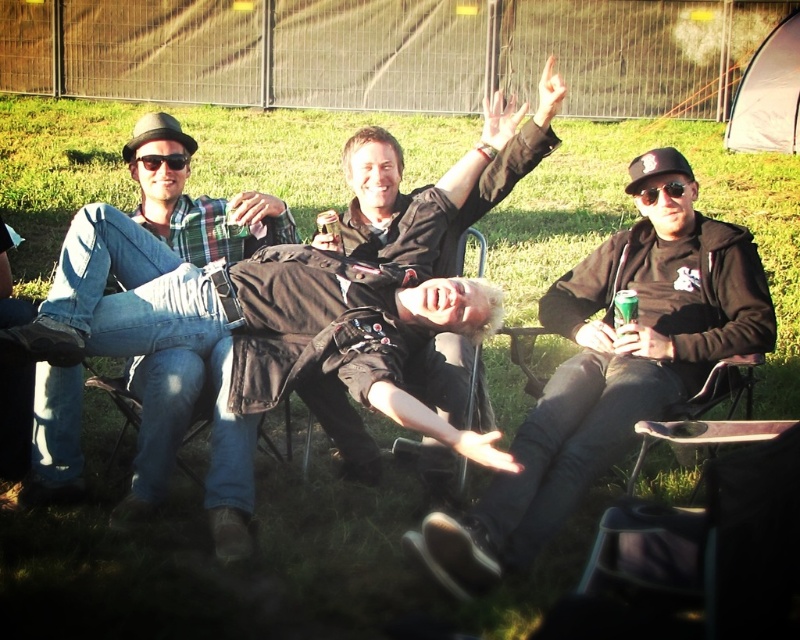
You are standing in front of the group of people sitting on folding chairs. You want to place a small flag at the point closer to the camera between the two points labeled point (666, 304) and point (441, 348). Which point should you choose?

You should choose point (666, 304) because it is further to the camera than point (441, 348).

You are a photographer trying to capture a candid shot of the metallic silver can at center and the black plastic sunglasses at upper left. Since you want to ensure both objects are in focus, you need to know their relative sizes. Which object is taller?

The metallic silver can at center is taller than the black plastic sunglasses at upper left.

You are a photographer trying to capture a candid shot of the black matte jacket at center and the black fabric chair at center. Since both are black, you want to ensure you can distinguish them in the photo. According to the scene, which object is positioned higher?

The black matte jacket at center is located above the black fabric chair at center, so it will appear higher in the photo.